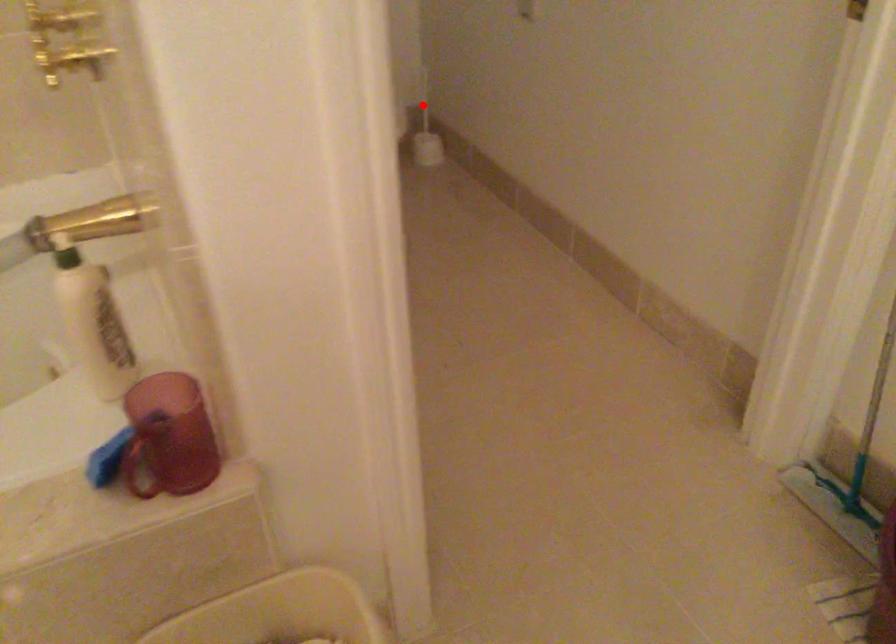
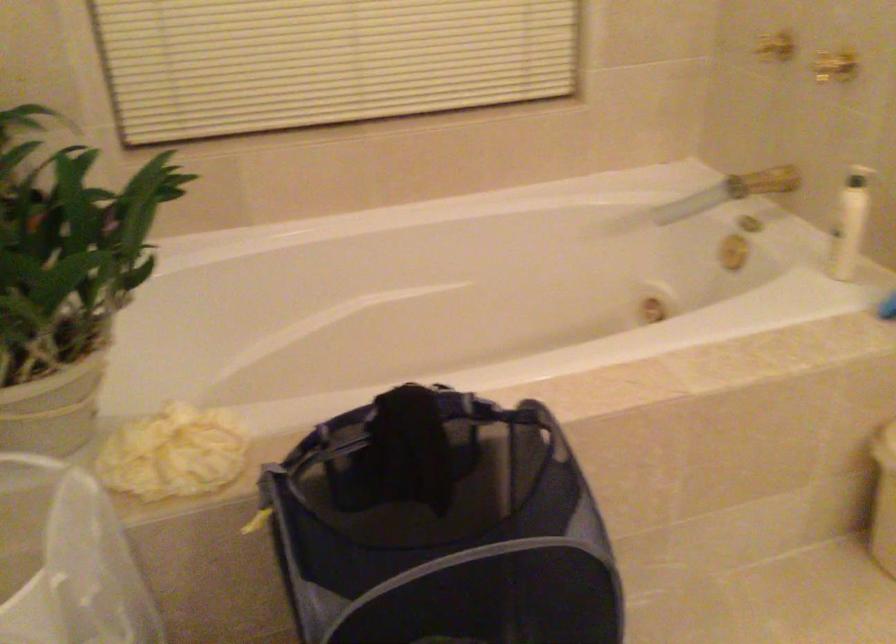
Question: I am providing you with two images of the same scene from different viewpoints. A red point is marked on the first image. Can you still see the location of the red point in image 2?

Choices:
 (A) Yes
 (B) No

Answer: (B)